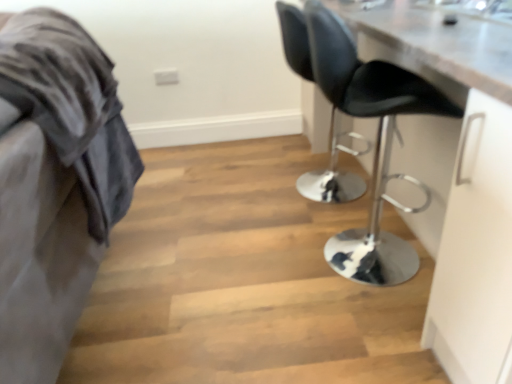
This screenshot has width=512, height=384. Find the location of `vacant space in front of black leather chair at right, which is the 1th chair from front to back`. vacant space in front of black leather chair at right, which is the 1th chair from front to back is located at coordinates (350, 339).